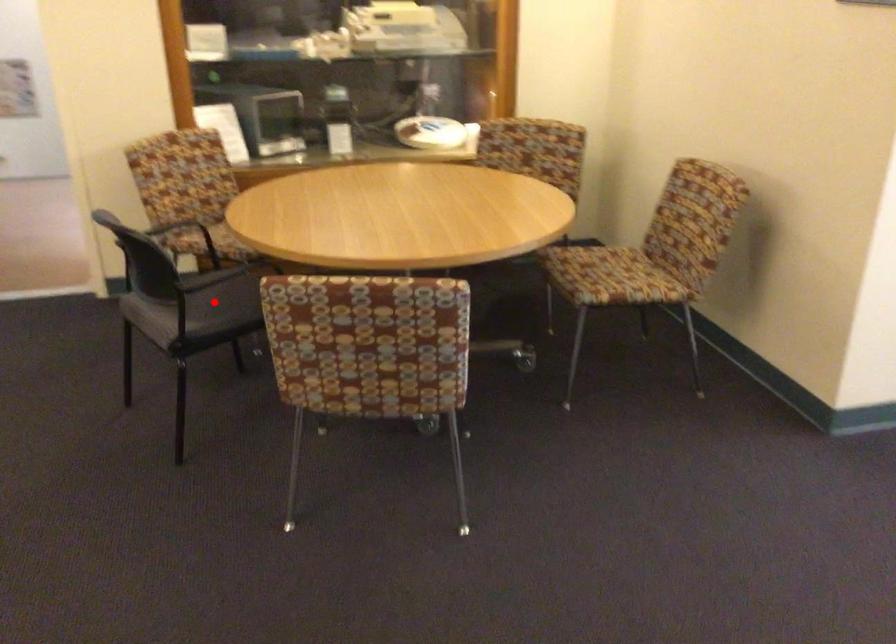
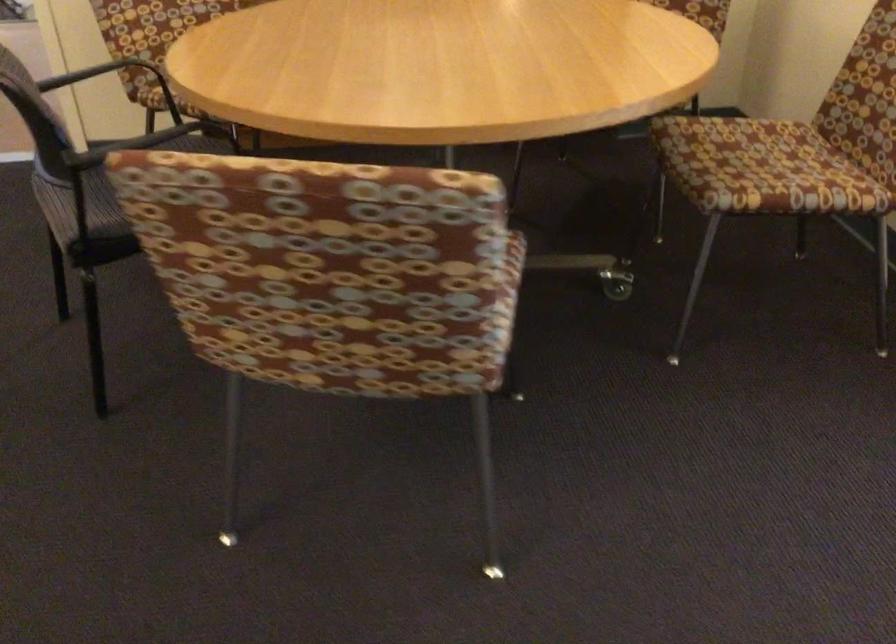
Question: I am providing you with two images of the same scene from different viewpoints. A red point is marked on the first image. Can you still see the location of the red point in image 2?

Choices:
 (A) Yes
 (B) No

Answer: (B)